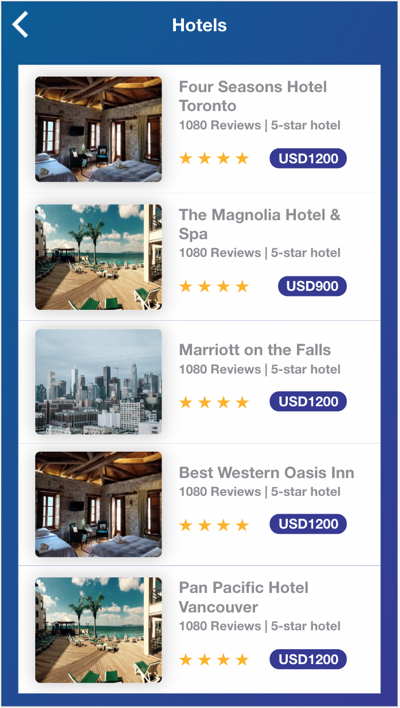
Find the location of `identical indoor pictures`. identical indoor pictures is located at coordinates (85, 476), (85, 127).